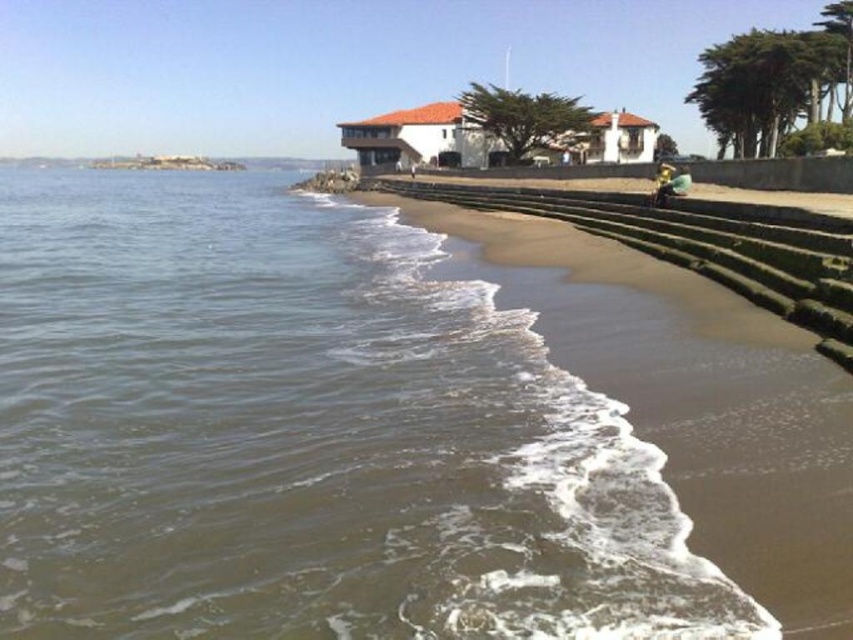
Question: Which of the following is the closest to the observer?

Choices:
 (A) brown matte water at lower left
 (B) golden metallic helmet at lower right

Answer: (A)

Question: From the image, what is the correct spatial relationship of brown matte water at lower left in relation to golden metallic helmet at lower right?

Choices:
 (A) right
 (B) left

Answer: (B)

Question: Is brown matte water at lower left closer to the viewer compared to golden metallic helmet at lower right?

Choices:
 (A) yes
 (B) no

Answer: (A)

Question: Is brown matte water at lower left smaller than golden metallic helmet at lower right?

Choices:
 (A) yes
 (B) no

Answer: (B)

Question: Which point is closer to the camera?

Choices:
 (A) (660, 177)
 (B) (277, 596)

Answer: (B)